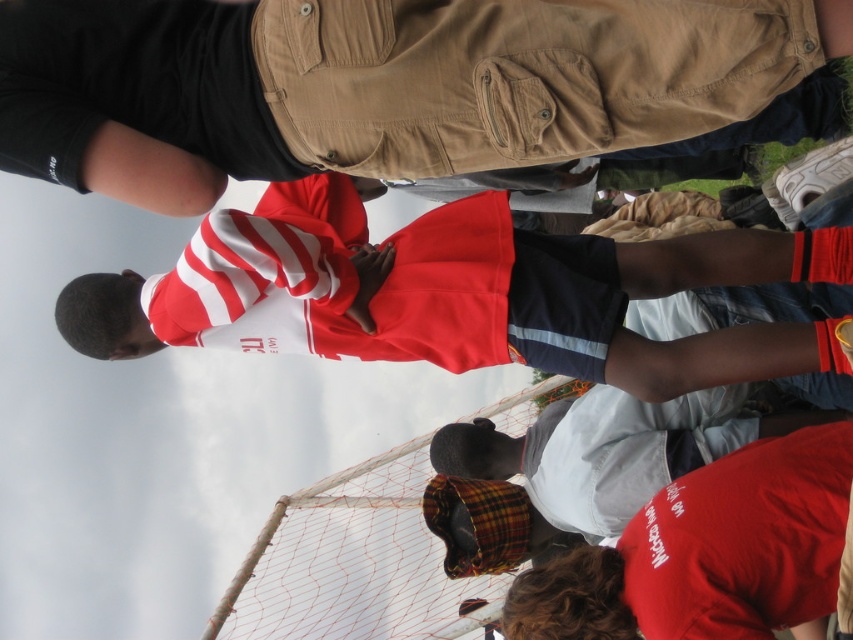
Between matte khaki cargo pants at center and red and white striped shirt at center, which one is positioned lower?

Positioned lower is red and white striped shirt at center.

Does matte khaki cargo pants at center appear under red and white striped shirt at center?

Actually, matte khaki cargo pants at center is above red and white striped shirt at center.

Which is in front, point (59, 160) or point (431, 348)?

Positioned in front is point (59, 160).

Locate an element on the screen. Image resolution: width=853 pixels, height=640 pixels. matte khaki cargo pants at center is located at coordinates (378, 84).